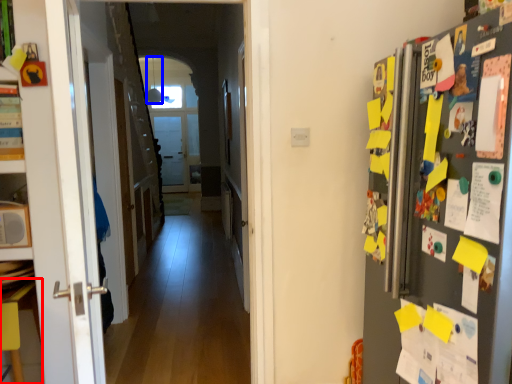
Question: Which object is closer to the camera taking this photo, table (highlighted by a red box) or lamp (highlighted by a blue box)?

Choices:
 (A) table
 (B) lamp

Answer: (A)